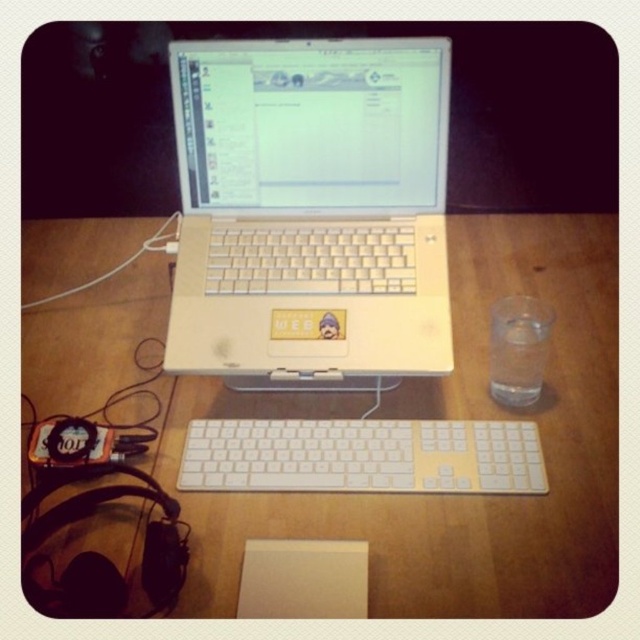
Is wooden table at center to the left of clear glass water at right from the viewer's perspective?

Correct, you'll find wooden table at center to the left of clear glass water at right.

Does wooden table at center come behind clear glass water at right?

No.

Who is more forward, [588,259] or [515,380]?

Point [515,380] is in front.

Find the location of `wooden table at center`. wooden table at center is located at coordinates (451, 417).

Does white plastic keyboard at center appear under clear glass water at right?

Answer: Indeed, white plastic keyboard at center is positioned under clear glass water at right.

Who is positioned more to the right, white plastic keyboard at center or clear glass water at right?

From the viewer's perspective, clear glass water at right appears more on the right side.

Identify the location of white plastic keyboard at center. (362, 456).

Is point (468, 403) positioned after point (349, 456)?

Yes.

Between point (541, 529) and point (288, 420), which one is positioned in front?

Positioned in front is point (541, 529).

In the scene shown: Who is more forward, (x=529, y=246) or (x=454, y=464)?

Positioned in front is point (x=454, y=464).

Where is `wooden table at center`? wooden table at center is located at coordinates (451, 417).